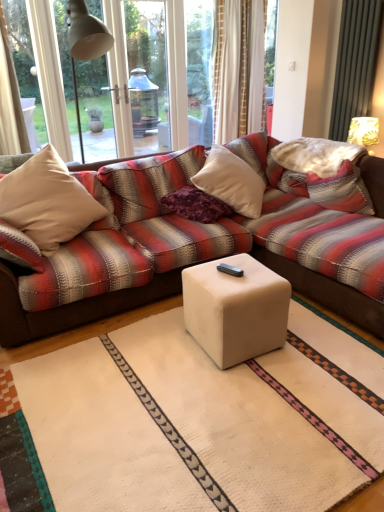
Question: Is beige fabric pillow at left aimed at white matte cube at center?

Choices:
 (A) no
 (B) yes

Answer: (B)

Question: Could white matte cube at center be considered to be inside beige fabric pillow at left?

Choices:
 (A) yes
 (B) no

Answer: (B)

Question: Is beige fabric pillow at left outside of white matte cube at center?

Choices:
 (A) no
 (B) yes

Answer: (B)

Question: Is beige fabric pillow at left further to the viewer compared to white matte cube at center?

Choices:
 (A) yes
 (B) no

Answer: (A)

Question: Is beige fabric pillow at left looking in the opposite direction of white matte cube at center?

Choices:
 (A) yes
 (B) no

Answer: (B)

Question: Is beige fabric pillow at left in front of white matte cube at center?

Choices:
 (A) yes
 (B) no

Answer: (B)

Question: From a real-world perspective, is white fabric lampshade at upper right under purple textured pillow at center, the first pillow when ordered from left to right?

Choices:
 (A) no
 (B) yes

Answer: (A)

Question: Considering the relative sizes of white fabric lampshade at upper right and purple textured pillow at center, the first pillow when ordered from left to right, in the image provided, is white fabric lampshade at upper right bigger than purple textured pillow at center, the first pillow when ordered from left to right,?

Choices:
 (A) yes
 (B) no

Answer: (B)

Question: Can you confirm if white fabric lampshade at upper right is wider than purple textured pillow at center, placed as the 2th pillow when sorted from right to left?

Choices:
 (A) yes
 (B) no

Answer: (B)

Question: From the image's perspective, would you say white fabric lampshade at upper right is shown under purple textured pillow at center, placed as the 2th pillow when sorted from right to left?

Choices:
 (A) yes
 (B) no

Answer: (B)

Question: Considering the relative positions of white fabric lampshade at upper right and purple textured pillow at center, the first pillow when ordered from left to right, in the image provided, is white fabric lampshade at upper right to the left of purple textured pillow at center, the first pillow when ordered from left to right, from the viewer's perspective?

Choices:
 (A) no
 (B) yes

Answer: (A)

Question: Does white fabric lampshade at upper right have a lesser height compared to purple textured pillow at center, the first pillow when ordered from left to right?

Choices:
 (A) yes
 (B) no

Answer: (B)

Question: From the image's perspective, would you say purple textured pillow at center, the first pillow when ordered from left to right, is positioned over white fabric lampshade at upper right?

Choices:
 (A) yes
 (B) no

Answer: (B)